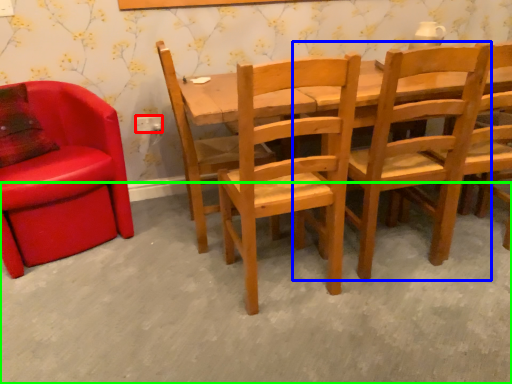
Question: Based on their relative distances, which object is nearer to power outlet (highlighted by a red box)? Choose from chair (highlighted by a blue box) and concrete (highlighted by a green box).

Choices:
 (A) chair
 (B) concrete

Answer: (B)